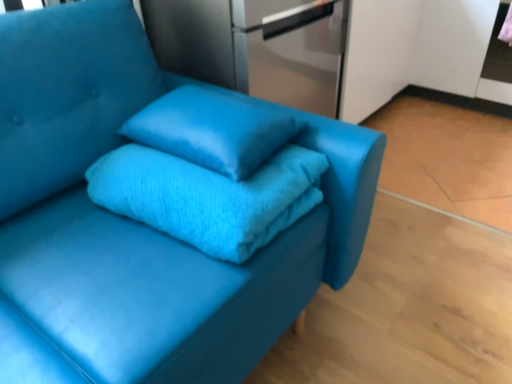
Describe the element at coordinates (208, 197) in the screenshot. I see `turquoise fuzzy bath towel at center` at that location.

What are the coordinates of `matte blue pillow at center` in the screenshot? It's located at (211, 130).

Could you tell me if matte blue pillow at center is facing satin silver refrigerator at upper center?

No, matte blue pillow at center is not facing towards satin silver refrigerator at upper center.

Measure the distance from matte blue pillow at center to satin silver refrigerator at upper center.

matte blue pillow at center and satin silver refrigerator at upper center are 17.64 inches apart.

From a real-world perspective, is matte blue pillow at center physically below satin silver refrigerator at upper center?

No, from a real-world perspective, matte blue pillow at center is not below satin silver refrigerator at upper center.

Considering the positions of point (180, 153) and point (191, 175), is point (180, 153) closer or farther from the camera than point (191, 175)?

Point (180, 153) is positioned farther from the camera compared to point (191, 175).

Between matte blue pillow at center and turquoise fuzzy bath towel at center, which one has larger width?

Wider between the two is turquoise fuzzy bath towel at center.

Can you see matte blue pillow at center touching turquoise fuzzy bath towel at center?

Yes, the surface of matte blue pillow at center is in contact with turquoise fuzzy bath towel at center.

In the scene shown: How different are the orientations of turquoise fuzzy bath towel at center and satin silver refrigerator at upper center in degrees?

5.27 degrees.

Is turquoise fuzzy bath towel at center facing towards satin silver refrigerator at upper center?

No, turquoise fuzzy bath towel at center is not facing towards satin silver refrigerator at upper center.

Considering their positions, is turquoise fuzzy bath towel at center located in front of or behind satin silver refrigerator at upper center?

turquoise fuzzy bath towel at center is in front of satin silver refrigerator at upper center.

Is the surface of turquoise fuzzy bath towel at center in direct contact with satin silver refrigerator at upper center?

turquoise fuzzy bath towel at center is not next to satin silver refrigerator at upper center, and they're not touching.

Who is shorter, satin silver refrigerator at upper center or matte blue pillow at center?

matte blue pillow at center is shorter.

Is satin silver refrigerator at upper center aimed at matte blue pillow at center?

No, satin silver refrigerator at upper center is not facing towards matte blue pillow at center.

This screenshot has width=512, height=384. In the image, there is a satin silver refrigerator at upper center. In order to click on pillow below it (from the image's perspective) in this screenshot , I will do `click(211, 130)`.

Consider the image. From the image's perspective, relative to matte blue pillow at center, is satin silver refrigerator at upper center above or below?

Based on their image positions, satin silver refrigerator at upper center is located above matte blue pillow at center.

From the image's perspective, which object appears higher, turquoise fuzzy bath towel at center or matte blue pillow at center?

matte blue pillow at center, from the image's perspective.

From the picture: Would you say turquoise fuzzy bath towel at center is inside or outside matte blue pillow at center?

turquoise fuzzy bath towel at center cannot be found inside matte blue pillow at center.

Is turquoise fuzzy bath towel at center looking in the opposite direction of matte blue pillow at center?

turquoise fuzzy bath towel at center is not turned away from matte blue pillow at center.

Based on the photo, how different are the orientations of satin silver refrigerator at upper center and turquoise fuzzy bath towel at center in degrees?

They differ by 5.27 degrees in their facing directions.

Is satin silver refrigerator at upper center in front of turquoise fuzzy bath towel at center?

That is False.

From the image's perspective, relative to turquoise fuzzy bath towel at center, is satin silver refrigerator at upper center above or below?

From the image's perspective, satin silver refrigerator at upper center appears above turquoise fuzzy bath towel at center.

Is satin silver refrigerator at upper center with turquoise fuzzy bath towel at center?

No, satin silver refrigerator at upper center is not in contact with turquoise fuzzy bath towel at center.

Find the location of a particular element. This screenshot has height=384, width=512. pillow that is in front of the satin silver refrigerator at upper center is located at coordinates (211, 130).

Where is `bath towel lying below the matte blue pillow at center (from the image's perspective)`? bath towel lying below the matte blue pillow at center (from the image's perspective) is located at coordinates (208, 197).

Estimate the real-world distances between objects in this image. Which object is closer to matte blue pillow at center, turquoise fuzzy bath towel at center or satin silver refrigerator at upper center?

turquoise fuzzy bath towel at center lies closer to matte blue pillow at center than the other object.

In the scene shown: Based on their spatial positions, is turquoise fuzzy bath towel at center or matte blue pillow at center further from satin silver refrigerator at upper center?

turquoise fuzzy bath towel at center lies further to satin silver refrigerator at upper center than the other object.

When comparing their distances from matte blue pillow at center, does satin silver refrigerator at upper center or turquoise fuzzy bath towel at center seem closer?

Based on the image, turquoise fuzzy bath towel at center appears to be nearer to matte blue pillow at center.

From the image, which object appears to be nearer to satin silver refrigerator at upper center, matte blue pillow at center or turquoise fuzzy bath towel at center?

matte blue pillow at center lies closer to satin silver refrigerator at upper center than the other object.

Considering their positions, is satin silver refrigerator at upper center positioned further to turquoise fuzzy bath towel at center than matte blue pillow at center?

Among the two, satin silver refrigerator at upper center is located further to turquoise fuzzy bath towel at center.

When comparing their distances from turquoise fuzzy bath towel at center, does matte blue pillow at center or satin silver refrigerator at upper center seem closer?

matte blue pillow at center lies closer to turquoise fuzzy bath towel at center than the other object.

At what (x,y) coordinates should I click in order to perform the action: click on pillow between satin silver refrigerator at upper center and turquoise fuzzy bath towel at center in the vertical direction. Please return your answer as a coordinate pair (x, y). This screenshot has height=384, width=512. Looking at the image, I should click on (211, 130).